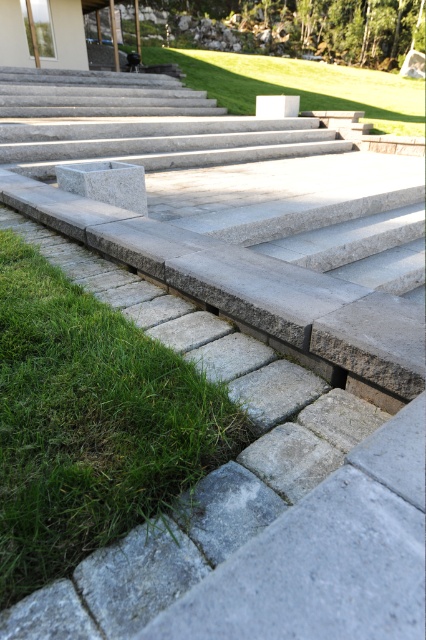
You are standing at the bottom of the stone steps and want to walk towards the house. Which green grass area should you step on first, the green grass at lower left or the green grass at center?

You should step on the green grass at lower left first because it is closer to you than the green grass at center.

You are a gardener planning to mow the lawn. You see two areas of green grass at lower left and green grass at center. Which area is located to the left of the other?

The green grass at lower left is positioned on the left side of green grass at center.